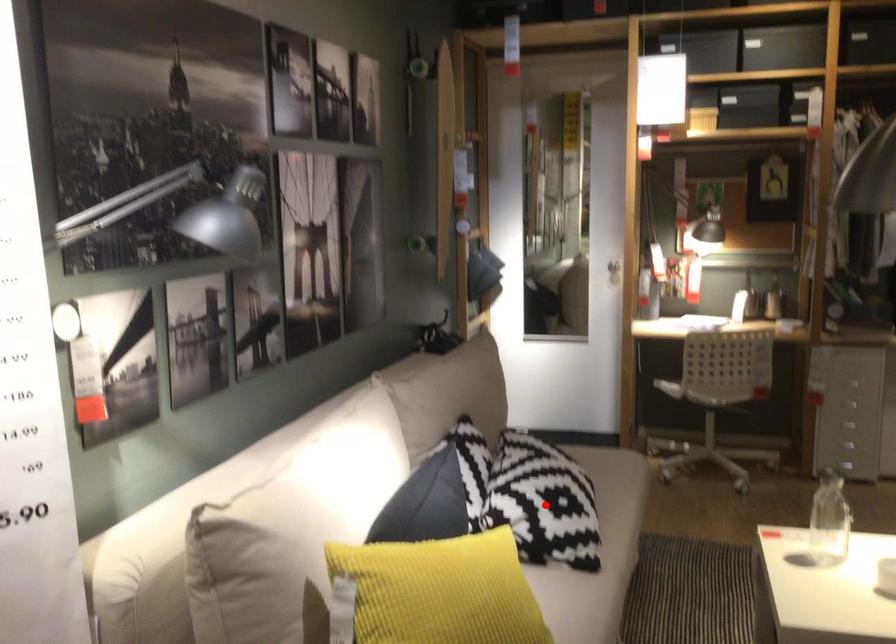
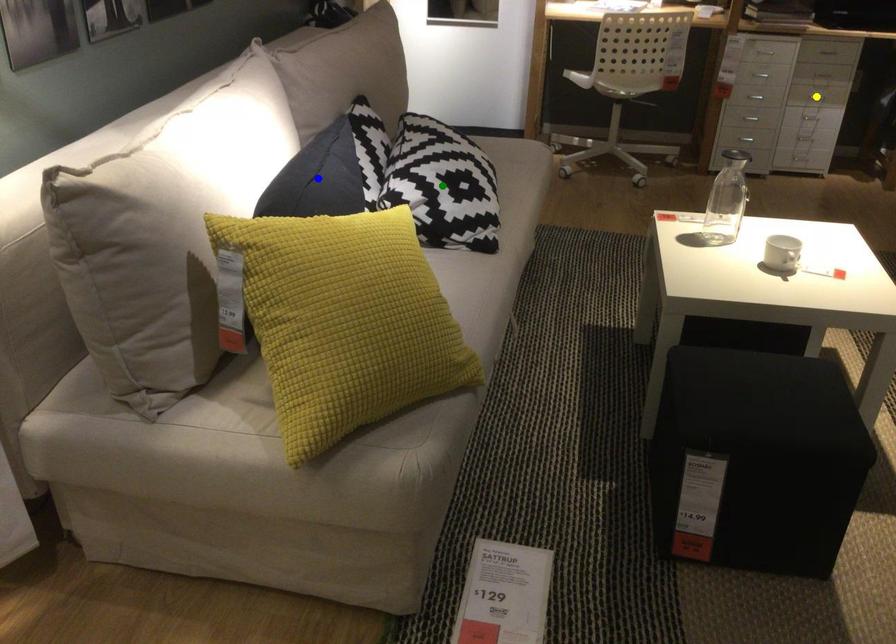
Question: I am providing you with two images of the same scene from different viewpoints. A red point is marked on the first image. You are given multiple points on the second image. Which point in image 2 is actually the same real-world point as the red point in image 1?

Choices:
 (A) green point
 (B) yellow point
 (C) blue point

Answer: (A)